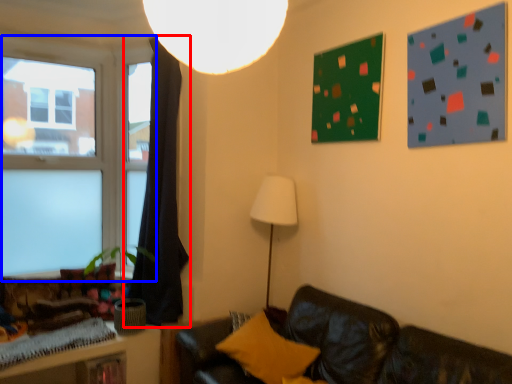
Question: Which point is closer to the camera, curtain (highlighted by a red box) or window (highlighted by a blue box)?

Choices:
 (A) curtain
 (B) window

Answer: (A)